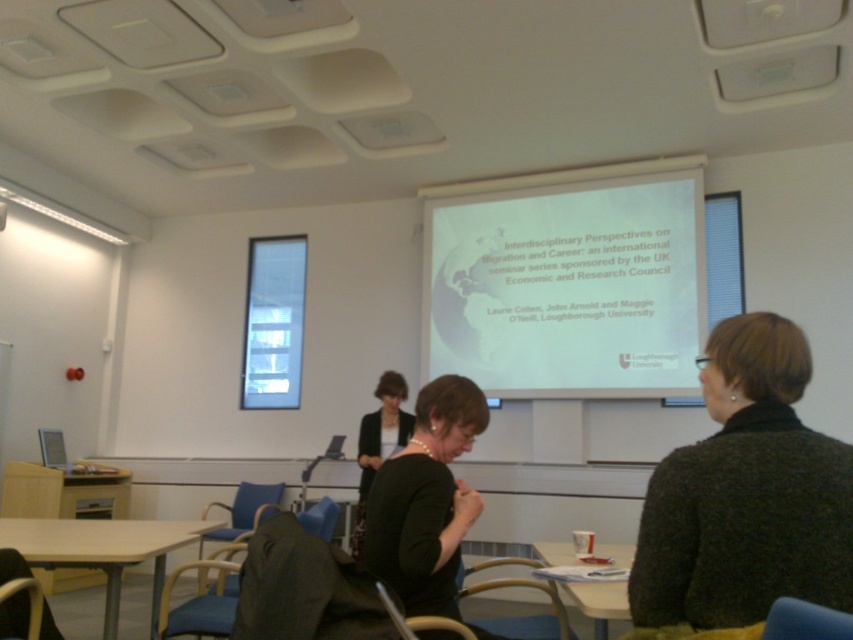
Question: Which object is farther from the camera taking this photo?

Choices:
 (A) dark green sweater at center
 (B) wooden table at lower center

Answer: (B)

Question: Is light brown wooden table at lower left positioned behind wooden table at lower center?

Choices:
 (A) no
 (B) yes

Answer: (B)

Question: Where is white matte projector screen at upper center located in relation to wooden table at lower center in the image?

Choices:
 (A) above
 (B) below

Answer: (A)

Question: Which object is the farthest from the wooden table at lower center?

Choices:
 (A) white matte projector screen at upper center
 (B) dark green sweater at center
 (C) black matte jacket at center
 (D) light brown wooden table at lower left

Answer: (A)

Question: Which object is the farthest from the white matte projector screen at upper center?

Choices:
 (A) light brown wooden table at lower left
 (B) wooden table at lower center
 (C) black matte jacket at center

Answer: (C)

Question: Does black matte jacket at center have a smaller size compared to wooden table at lower center?

Choices:
 (A) no
 (B) yes

Answer: (B)